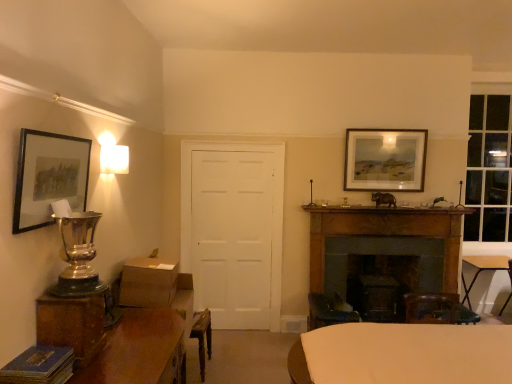
Question: Is wooden folding table at lower right, the 1th table from the back, wider or thinner than dark brown wood fireplace at center right?

Choices:
 (A) thin
 (B) wide

Answer: (B)

Question: From a real-world perspective, is wooden folding table at lower right, the 1th table from the back, physically located above or below dark brown wood fireplace at center right?

Choices:
 (A) above
 (B) below

Answer: (B)

Question: Estimate the real-world distances between objects in this image. Which object is farther from the wooden table at lower left, arranged as the 3th table when viewed from the back?

Choices:
 (A) white matte door at center
 (B) matte black picture frame at upper left, the 1th picture frame viewed from the front
 (C) dark brown wood fireplace at center right
 (D) matte wooden picture frame at upper right, the 2th picture frame from the front
 (E) wooden folding table at lower right, placed as the third table when sorted from left to right

Answer: (E)

Question: Which object is the farthest from the matte black picture frame at upper left, the 1th picture frame viewed from the front?

Choices:
 (A) white matte door at center
 (B) dark brown wood fireplace at center right
 (C) wooden folding table at lower right, the 1th table from the back
 (D) silver metallic trophy at left
 (E) wooden table at lower left, the 1th table positioned from the left

Answer: (C)